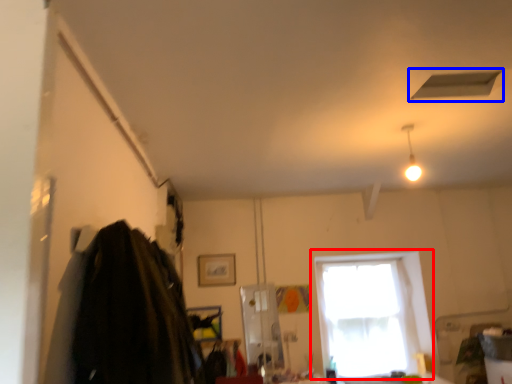
Question: Which object is closer to the camera taking this photo, window (highlighted by a red box) or exhaust hood (highlighted by a blue box)?

Choices:
 (A) window
 (B) exhaust hood

Answer: (B)